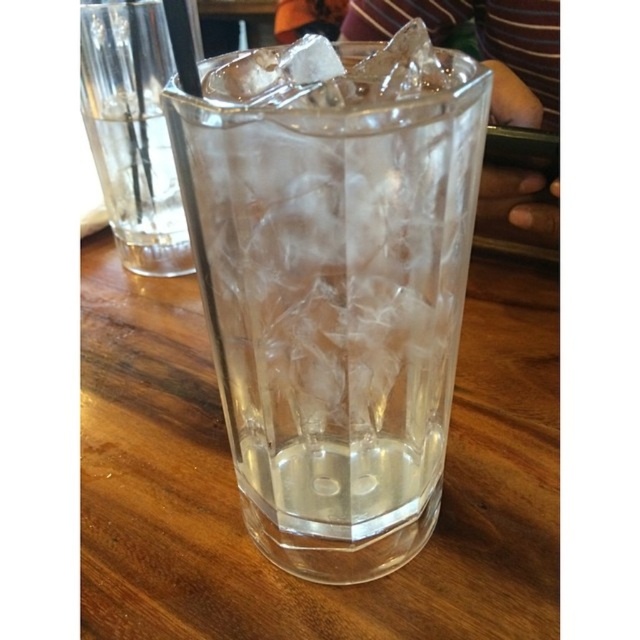
Is transparent glass at center bigger than clear glass at left?

No, transparent glass at center is not bigger than clear glass at left.

Who is more forward, (264, 536) or (115, 152)?

Point (264, 536) is more forward.

Is point (424, 220) positioned behind point (136, 237)?

No, it is not.

You are a GUI agent. You are given a task and a screenshot of the screen. Output one action in this format:
    pyautogui.click(x=<x>, y=<y>)
    Task: Click on the transparent glass at center
    The width and height of the screenshot is (640, 640).
    Given the screenshot: What is the action you would take?
    pyautogui.click(x=336, y=308)